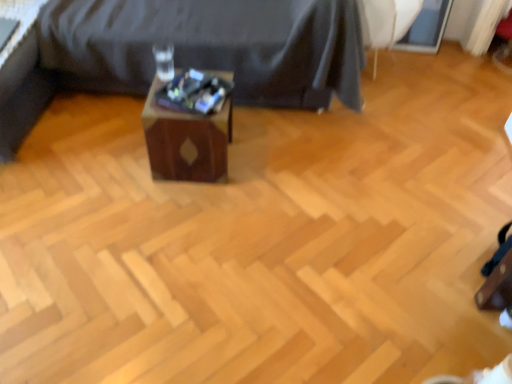
At what (x,y) coordinates should I click in order to perform the action: click on vacant area located to the right-hand side of wooden box at center. Please return your answer as a coordinate pair (x, y). The width and height of the screenshot is (512, 384). Looking at the image, I should click on (259, 167).